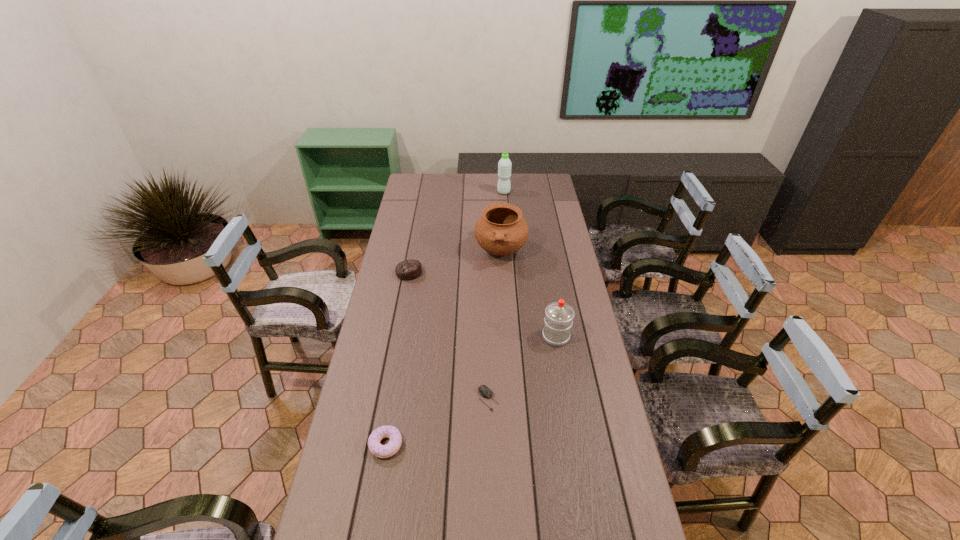
This screenshot has height=540, width=960. Find the location of `free space located 0.260m on the front of the farthest object`. free space located 0.260m on the front of the farthest object is located at coordinates (506, 224).

Where is `free space located 0.090m on the front of the pottery`? free space located 0.090m on the front of the pottery is located at coordinates (503, 285).

Find the location of a particular element. The height and width of the screenshot is (540, 960). free space located 0.300m on the handle side of the rightmost object is located at coordinates point(545,272).

Locate an element on the screen. The image size is (960, 540). vacant region located 0.240m on the handle side of the rightmost object is located at coordinates (546, 282).

Locate an element on the screen. This screenshot has width=960, height=540. free spot located 0.260m on the handle side of the rightmost object is located at coordinates (546, 279).

The width and height of the screenshot is (960, 540). Find the location of `vacant area situated 0.310m on the back of the beanbag`. vacant area situated 0.310m on the back of the beanbag is located at coordinates (419, 222).

This screenshot has height=540, width=960. What are the coordinates of `vacant space situated 0.140m on the back of the doughnut` in the screenshot? It's located at (396, 389).

Find the location of a particular element. This screenshot has height=540, width=960. free space located 0.130m on the right of the second nearest object is located at coordinates (541, 399).

I want to click on object that is at the far edge, so click(x=504, y=165).

This screenshot has width=960, height=540. I want to click on beanbag present at the left edge, so click(x=407, y=270).